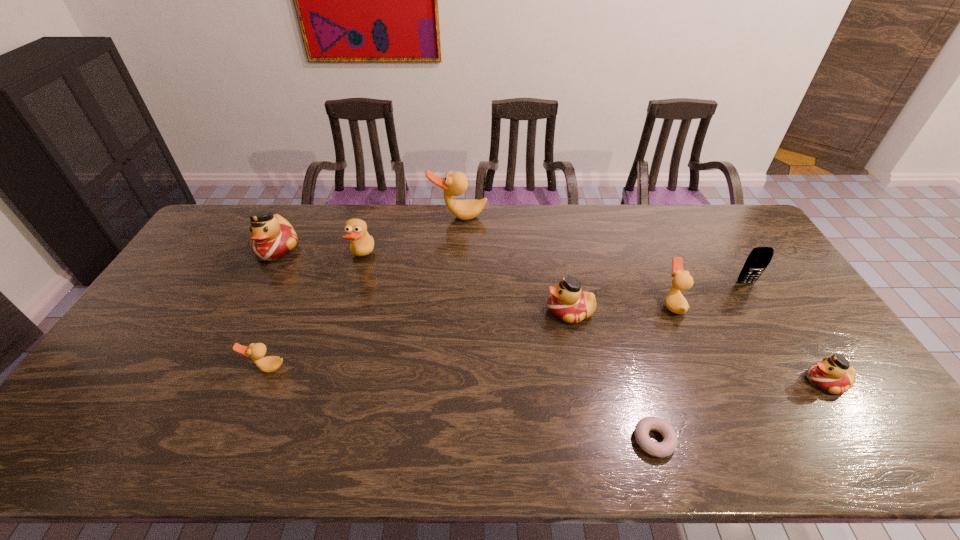
Locate an element on the screen. The width and height of the screenshot is (960, 540). the fourth duck from left to right is located at coordinates click(x=454, y=184).

Where is `the farthest tan duck`? The height and width of the screenshot is (540, 960). the farthest tan duck is located at coordinates (454, 184).

Find the location of a particular element. the leftmost duck is located at coordinates (273, 236).

I want to click on the farthest red duck, so click(273, 236).

You are a GUI agent. You are given a task and a screenshot of the screen. Output one action in this format:
    pyautogui.click(x=<x>, y=<y>)
    Task: Click on the second biggest tan duck
    Image resolution: width=960 pixels, height=540 pixels.
    Given the screenshot: What is the action you would take?
    pyautogui.click(x=362, y=244)

You are a GUI agent. You are given a task and a screenshot of the screen. Output one action in this format:
    pyautogui.click(x=<x>, y=<y>)
    Task: Click on the third tan duck from right to left
    
    Given the screenshot: What is the action you would take?
    pyautogui.click(x=362, y=244)

You are a GUI agent. You are given a task and a screenshot of the screen. Output one action in this format:
    pyautogui.click(x=<x>, y=<y>)
    Task: Click on the cellular telephone
    This screenshot has width=960, height=540.
    Given the screenshot: What is the action you would take?
    pyautogui.click(x=759, y=258)

Where is `the third duck from right to left`? the third duck from right to left is located at coordinates (567, 302).

The image size is (960, 540). What are the coordinates of `the second smallest red duck` in the screenshot? It's located at (567, 302).

Identify the location of the second nearest tan duck. The image size is (960, 540). (682, 280).